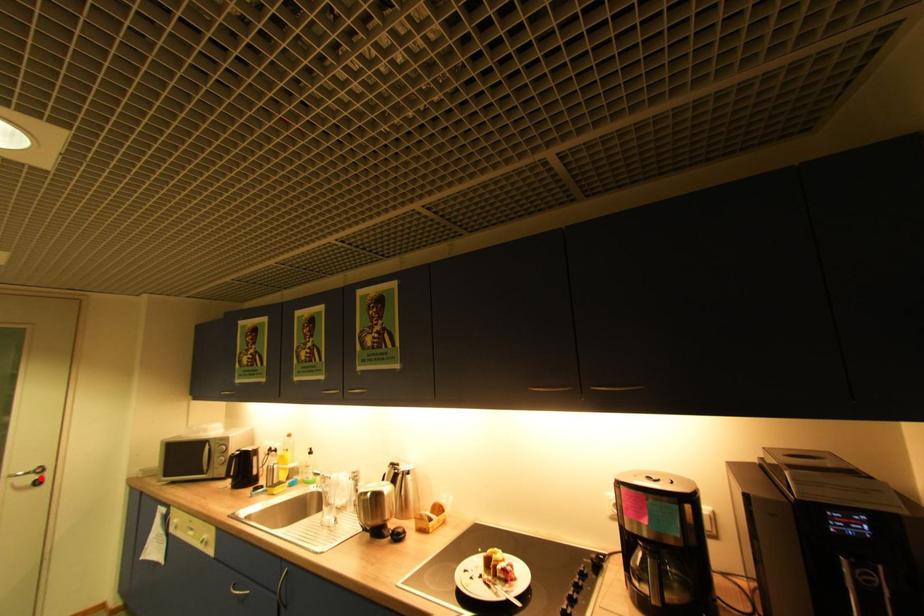
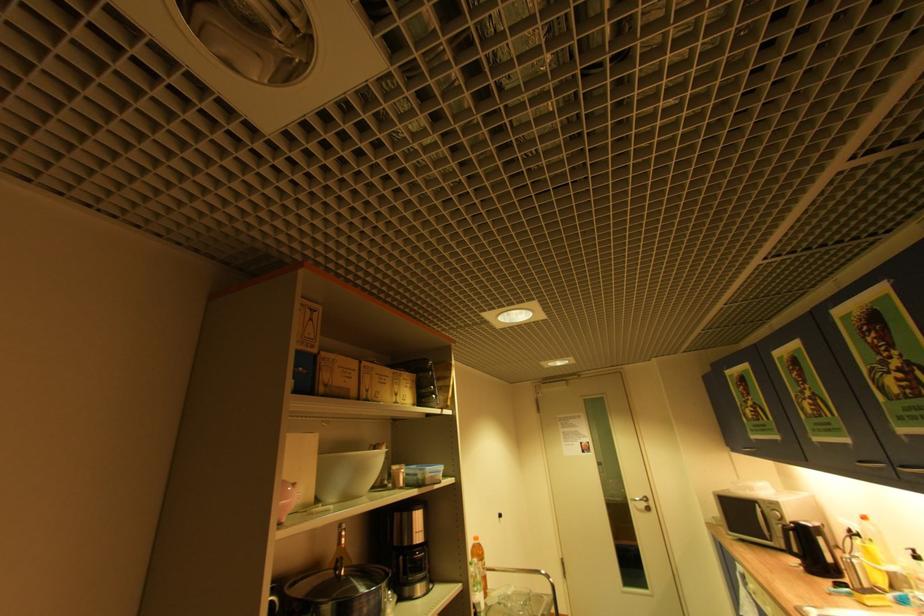
Question: I am providing you with two images of the same scene from different viewpoints. In image1, a red point is highlighted. Considering the same 3D point in image2, which of the following is correct?

Choices:
 (A) It is closer
 (B) It is farther

Answer: (B)